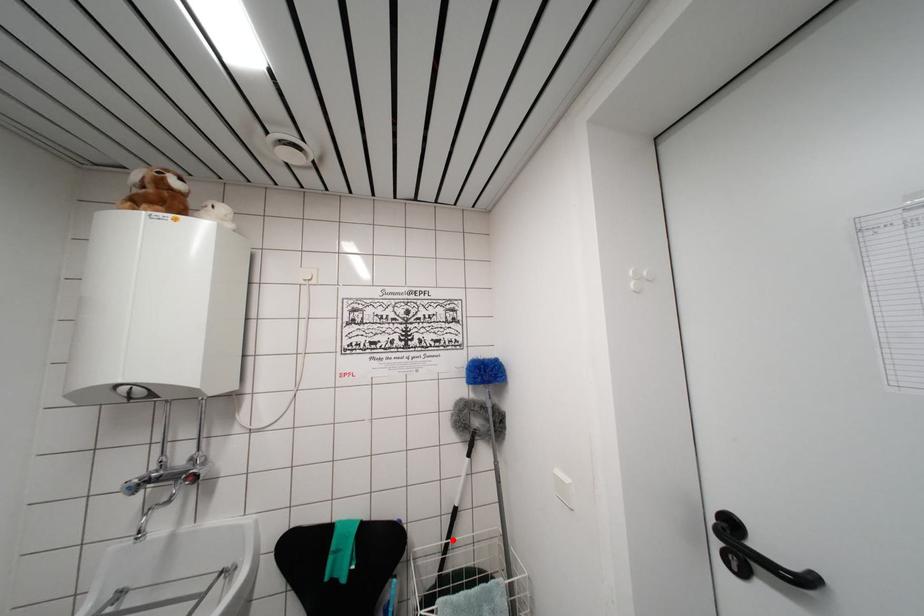
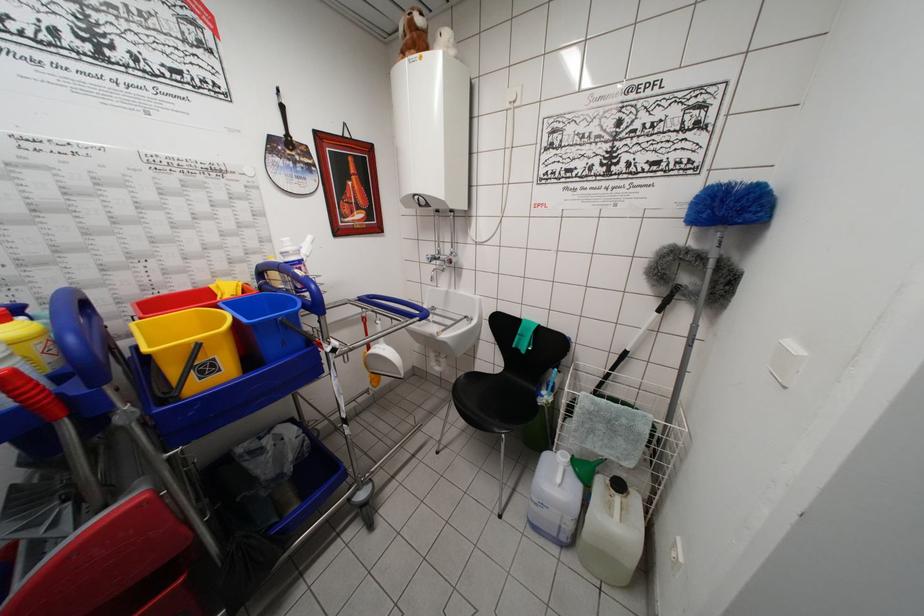
In the second image, find the point that corresponds to the highlighted location in the first image.

(616, 374)